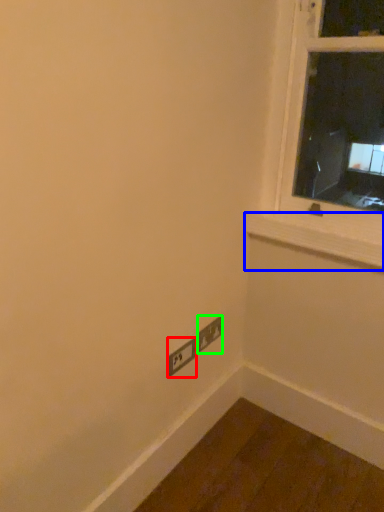
Question: Estimate the real-world distances between objects in this image. Which object is closer to power plugs and sockets (highlighted by a red box), window sill (highlighted by a blue box) or power plugs and sockets (highlighted by a green box)?

Choices:
 (A) window sill
 (B) power plugs and sockets

Answer: (B)